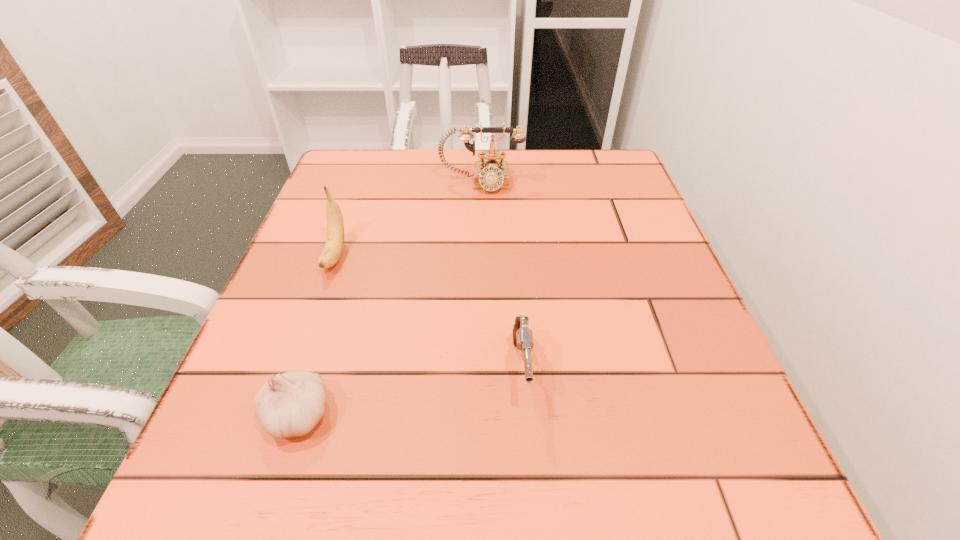
Find the location of a particular element. The width and height of the screenshot is (960, 540). garlic that is at the left edge is located at coordinates (291, 404).

Where is `blank area at the far edge`? The image size is (960, 540). blank area at the far edge is located at coordinates (397, 184).

This screenshot has width=960, height=540. What are the coordinates of `blank space at the near edge of the desktop` in the screenshot? It's located at (383, 463).

You are a GUI agent. You are given a task and a screenshot of the screen. Output one action in this format:
    pyautogui.click(x=<x>, y=<y>)
    Task: Click on the vacant point at the left edge
    The width and height of the screenshot is (960, 540).
    Given the screenshot: What is the action you would take?
    pyautogui.click(x=303, y=258)

At what (x,y) coordinates should I click in order to perform the action: click on vacant space at the right edge of the desktop. Please return your answer as a coordinate pair (x, y). The width and height of the screenshot is (960, 540). Looking at the image, I should click on (631, 256).

Where is `vacant space at the far left corner`? The image size is (960, 540). vacant space at the far left corner is located at coordinates point(386,163).

Locate an element on the screen. blank space at the far right corner of the desktop is located at coordinates pyautogui.click(x=566, y=171).

Locate an element on the screen. The height and width of the screenshot is (540, 960). empty location between the second farthest object and the garlic is located at coordinates (317, 335).

The height and width of the screenshot is (540, 960). What are the coordinates of `free space between the telephone and the pistol` in the screenshot? It's located at (501, 276).

Find the location of a particular element. empty space that is in between the garlic and the farthest object is located at coordinates pyautogui.click(x=390, y=299).